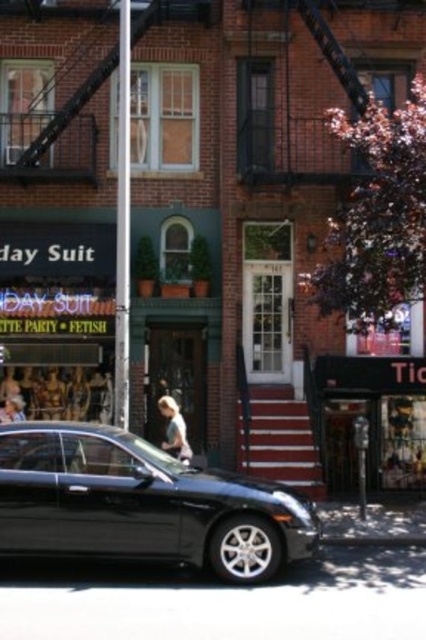
You are standing in front of the building and want to take a photo. You notice two points marked on the building. The first point is at coordinates point (411, 378) and the second is at point (382, 538). Which point will appear closer to the bottom of your camera view?

Point (382, 538) will appear closer to the bottom of your camera view because it is closer to the camera than point (411, 378).

You are a delivery person trying to park your 6.5 feet tall delivery van. You see the shiny black sedan at lower left and the metallic gray curb at lower center. Can your van fit between them vertically?

The shiny black sedan at lower left is much taller than the metallic gray curb at lower center. Since your van is 6.5 feet tall, you need to check if the space between them is taller than 6.5 feet. However, since the sedan is taller than the curb, the available vertical space might be limited. If the curb is lower than the van, the van might hit the curb. Without exact measurements, it is uncertain, but based on the description, the sedan being taller than the curb suggests the space between them may not be

You are a delivery person trying to park your 2.5 meter long bike near the curb. The bike requires at least 2 meters of space to park. Can you park your bike between the black matte sign at lower right and the metallic gray curb at lower center?

The black matte sign at lower right is larger in size than the metallic gray curb at lower center, but the exact distance between them isn not provided. Therefore, it is uncertain if there is enough space to park the bike.